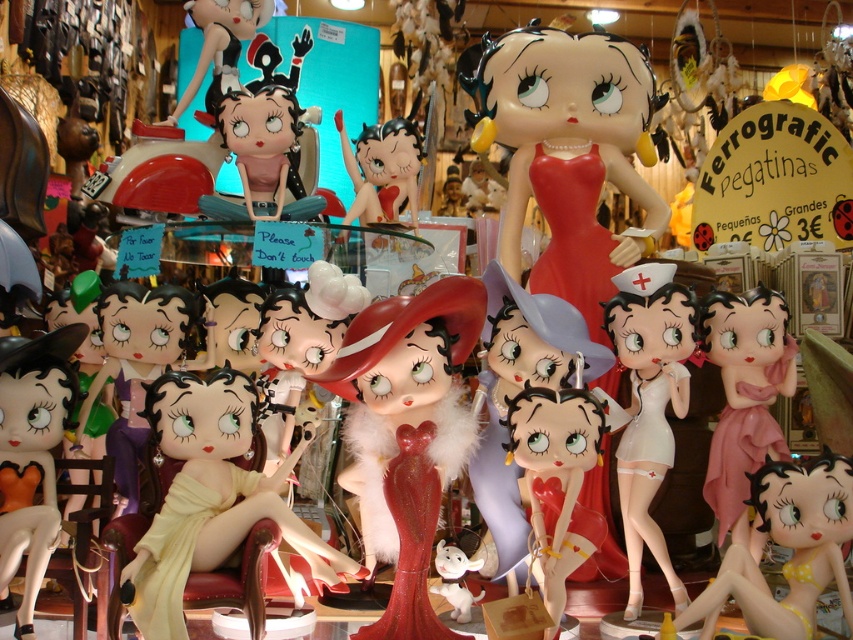
Is pink glossy figurine at center positioned in front of white plush elephant at center?

That is False.

Can you confirm if pink glossy figurine at center is positioned to the right of white plush elephant at center?

Correct, you'll find pink glossy figurine at center to the right of white plush elephant at center.

Does point (721, 342) come in front of point (447, 580)?

No, it is not.

I want to click on pink glossy figurine at center, so click(x=746, y=400).

Between shiny red dress at center and yellow polka dot bikini at center, which one appears on the left side from the viewer's perspective?

shiny red dress at center is more to the left.

Does point (358, 404) come closer to viewer compared to point (790, 621)?

No, it is not.

Which is in front, point (328, 385) or point (802, 547)?

Point (328, 385) is more forward.

Where is `shiny red dress at center`? shiny red dress at center is located at coordinates (407, 433).

Does point (822, 497) lie in front of point (733, 330)?

Yes, point (822, 497) is in front of point (733, 330).

Between point (732, 547) and point (770, 451), which one is positioned behind?

The point (770, 451) is more distant.

Who is more distant from viewer, (833, 557) or (735, 296)?

Positioned behind is point (735, 296).

In order to click on yellow polka dot bikini at center in this screenshot , I will do `click(786, 547)`.